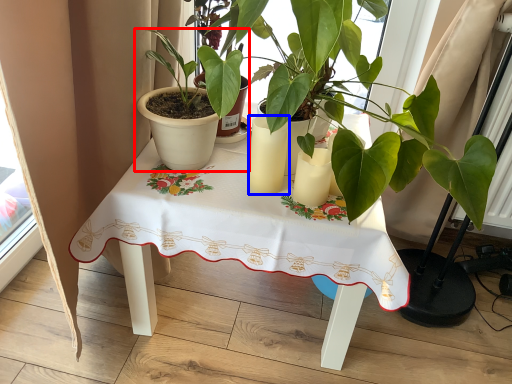
Question: Which object appears closest to the camera in this image, houseplant (highlighted by a red box) or candle holder (highlighted by a blue box)?

Choices:
 (A) houseplant
 (B) candle holder

Answer: (A)